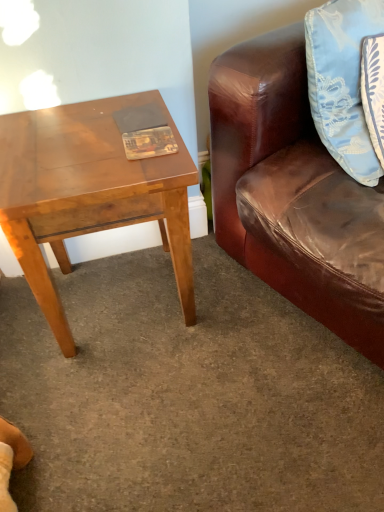
Find the location of `free location above light brown wooden table at left (from a real-world perspective)`. free location above light brown wooden table at left (from a real-world perspective) is located at coordinates tap(86, 144).